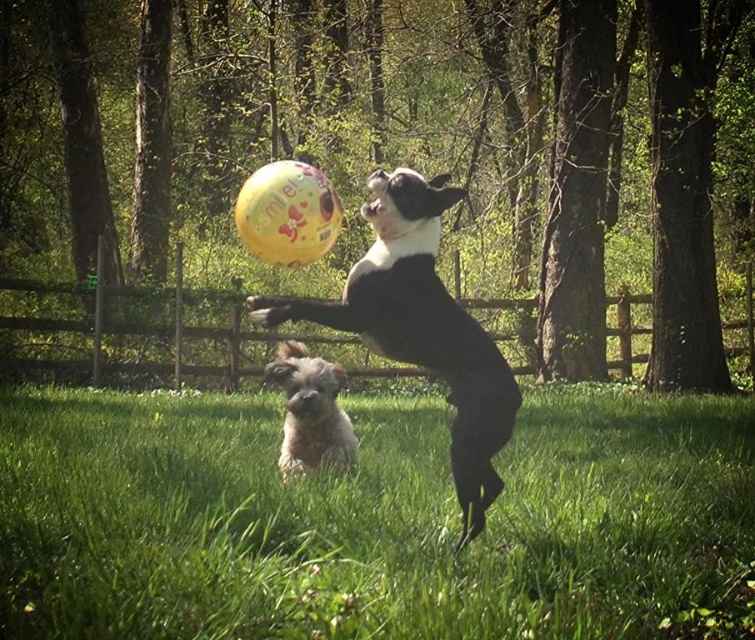
You are a photographer trying to capture both the black and white fur dog at center and the fluffy white dog at lower center in a single shot. Based on their heights, which dog should you focus on first to ensure both are in frame?

The black and white fur dog at center is much taller than the fluffy white dog at lower center, so you should focus on the taller dog first to ensure both are in frame.

Based on the photo, you are a photographer trying to capture a photo of the black and white fur dog at center and the green grass at lower center. Which one would you focus on first if you want to ensure both are in the frame?

The black and white fur dog at center should be focused on first because the green grass at lower center is smaller in size, making it easier to adjust the framing to include both.

You are standing at the camera position and want to throw a ball to a point that is exactly 15 feet away from you. Is the point at coordinates point [430,252] within the desired distance?

The distance of point [430,252] from camera is 15.68 feet, which is slightly more than 15 feet. Therefore, the point is just beyond the desired distance of 15 feet.